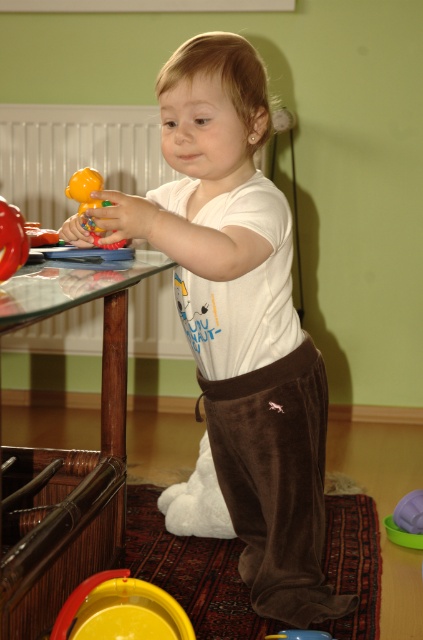
You are a toy designer observing the scene. You need to place a new toy between the two points, point (x=96, y=243) and point (x=302, y=632). To ensure it is visible to most viewers, which point should you place it closer to?

You should place the new toy closer to point (x=96, y=243) because it is closer to the viewer than point (x=302, y=632), making it more visible.

Please describe the exact position of the matte yellow rubber duck at left in the image using coordinates.

The matte yellow rubber duck at left is located at coordinates point (x=90, y=202).